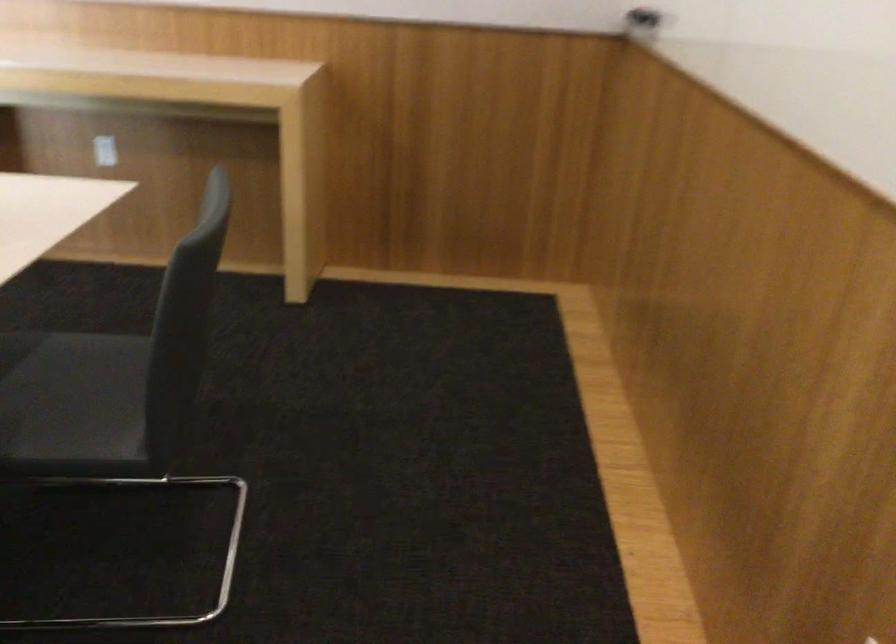
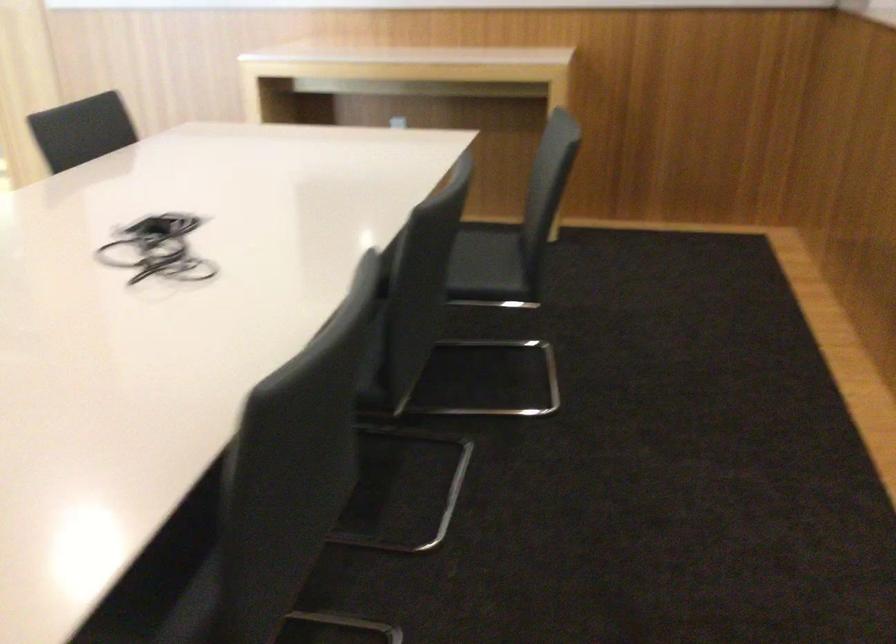
Where in the second image is the point corresponding to [114,399] from the first image?

(490, 266)